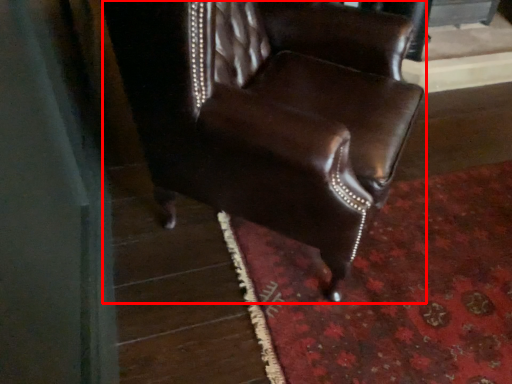
Question: From the image's perspective, what is the correct spatial relationship of chair (annotated by the red box) in relation to mat?

Choices:
 (A) below
 (B) above

Answer: (B)